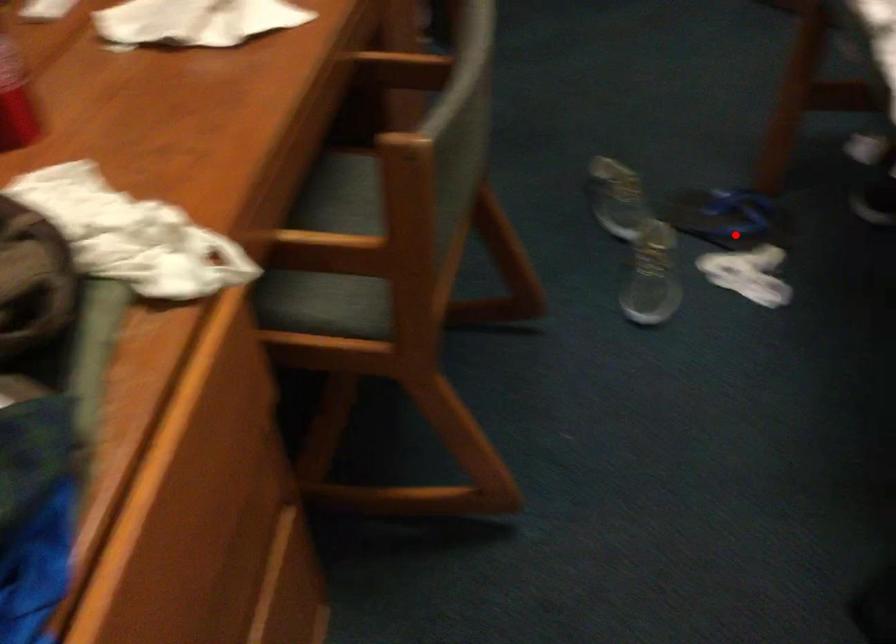
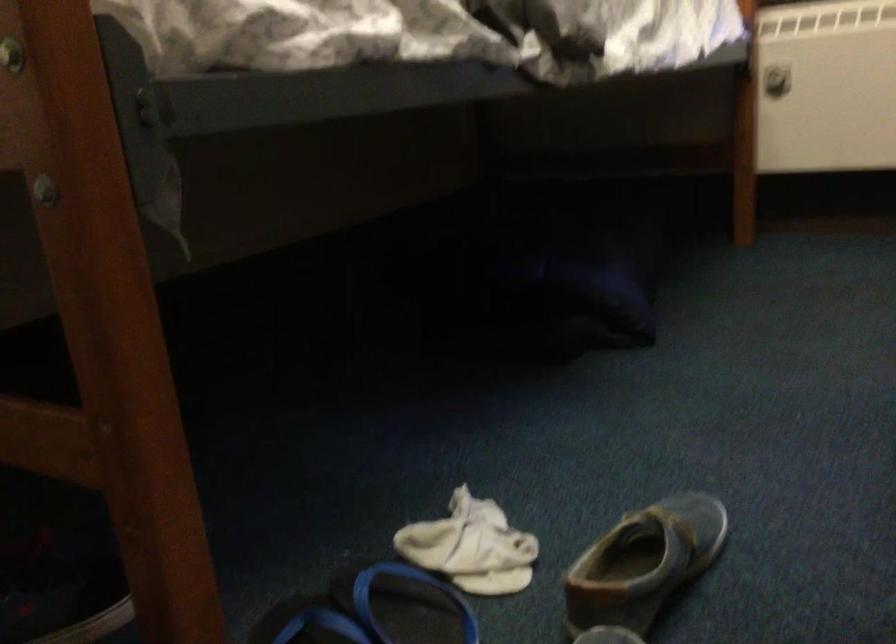
The point at the highlighted location is marked in the first image. Where is the corresponding point in the second image?

(406, 605)